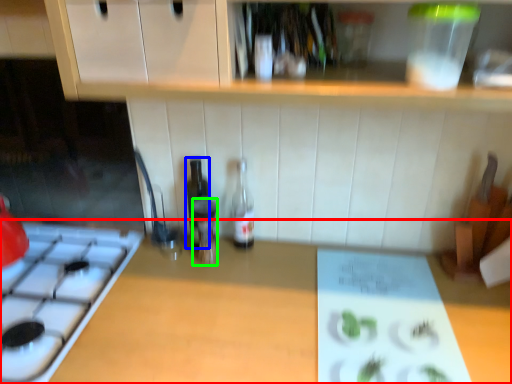
Question: Estimate the real-world distances between objects in this image. Which object is farther from countertop (highlighted by a red box), bottle (highlighted by a blue box) or bottle (highlighted by a green box)?

Choices:
 (A) bottle
 (B) bottle

Answer: (A)